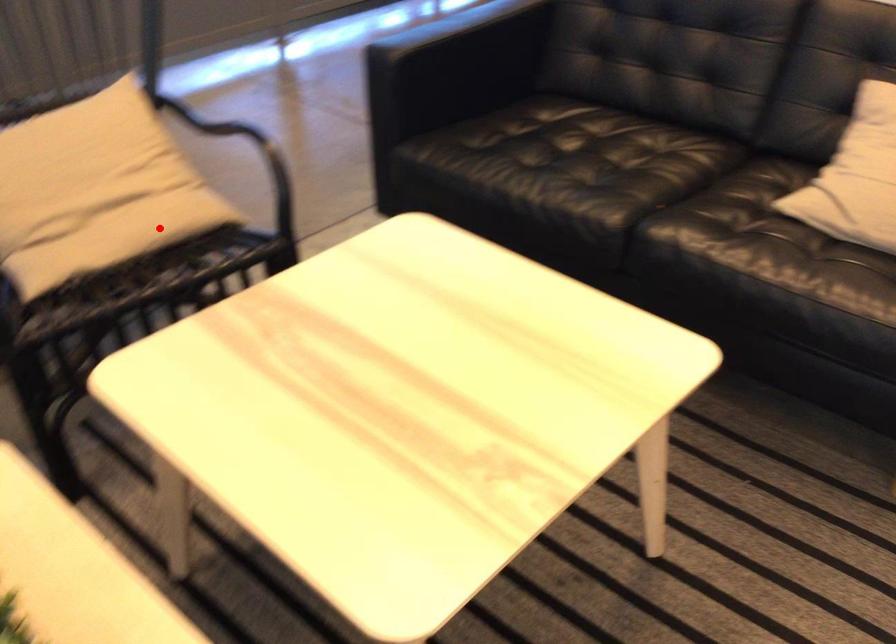
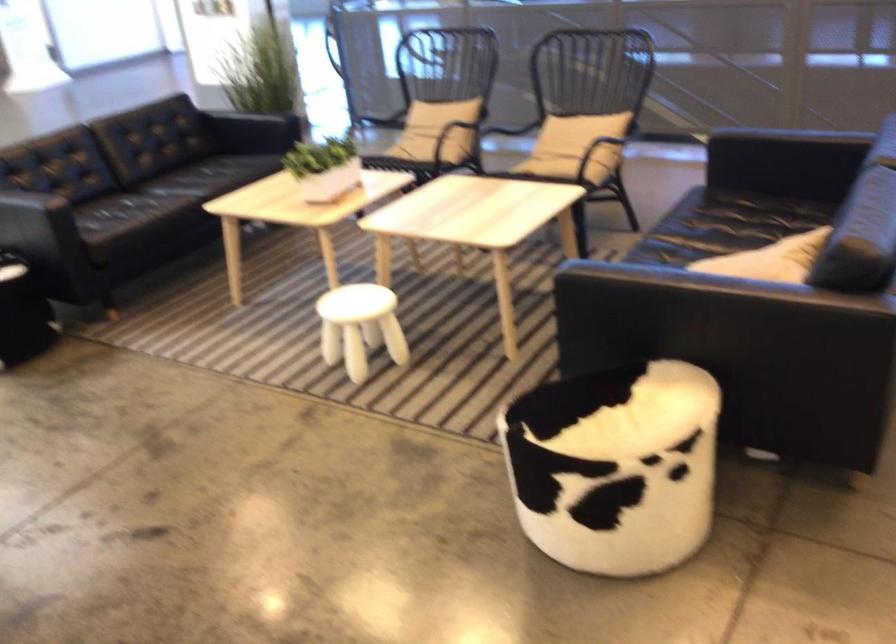
The point at the highlighted location is marked in the first image. Where is the corresponding point in the second image?

(552, 160)